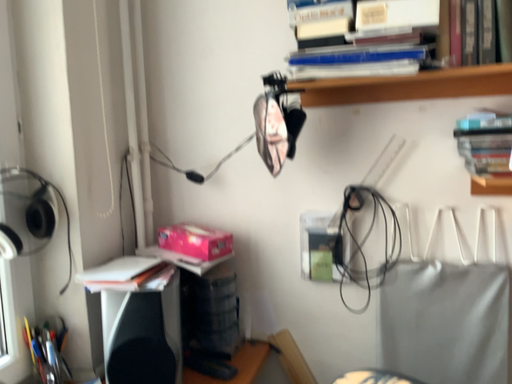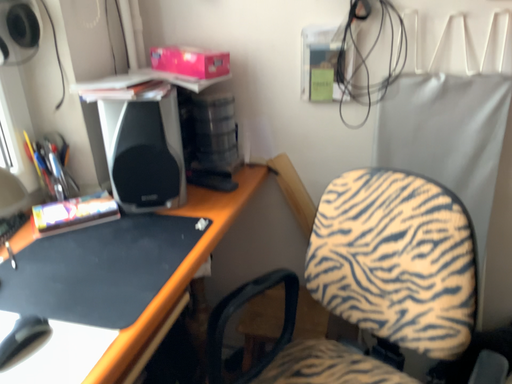
Question: Which way did the camera rotate in the video?

Choices:
 (A) rotated downward
 (B) rotated upward

Answer: (A)